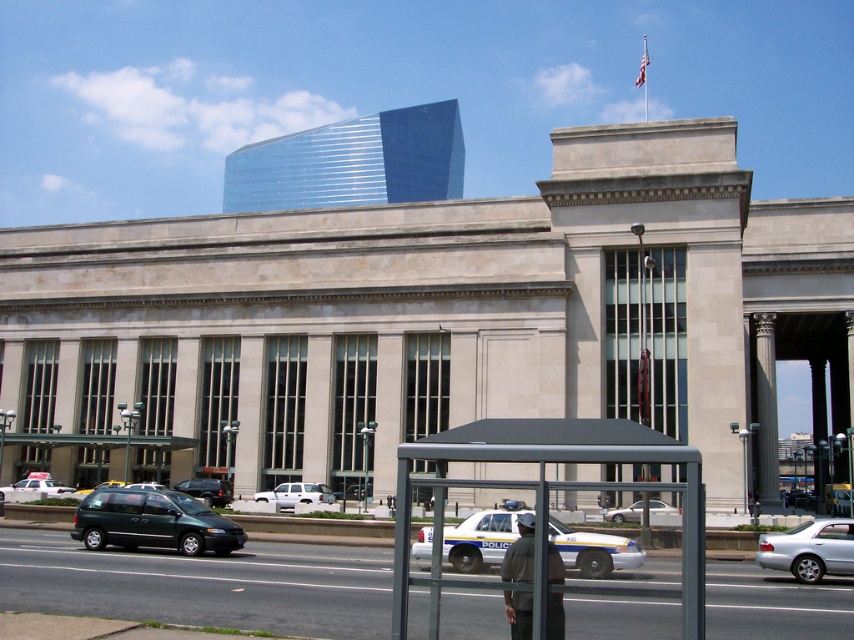
The height and width of the screenshot is (640, 854). In order to click on green matte minivan at lower left in this screenshot , I will do `click(153, 522)`.

Who is lower down, green matte minivan at lower left or silver metallic sedan at center?

silver metallic sedan at center is lower down.

Who is more forward, (243, 531) or (676, 512)?

Point (243, 531) is in front.

Find the location of a particular element. green matte minivan at lower left is located at coordinates (153, 522).

Is silver metallic sedan at center in front of metallic silver taxi at center?

Yes, it is.

Which is more to the right, silver metallic sedan at center or metallic silver taxi at center?

silver metallic sedan at center

Image resolution: width=854 pixels, height=640 pixels. Identify the location of silver metallic sedan at center. (664, 513).

The height and width of the screenshot is (640, 854). I want to click on silver metallic sedan at center, so click(664, 513).

Describe the element at coordinates (34, 490) in the screenshot. I see `white matte sedan at center` at that location.

Does point (47, 474) come closer to viewer compared to point (200, 493)?

No, it is behind (200, 493).

The image size is (854, 640). In order to click on white matte sedan at center in this screenshot , I will do [x=34, y=490].